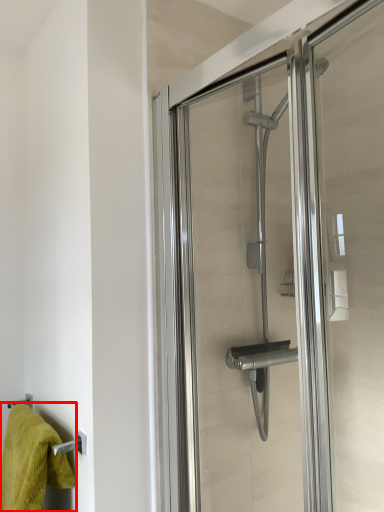
Question: Where is towel (annotated by the red box) located in relation to screen door in the image?

Choices:
 (A) left
 (B) right

Answer: (A)